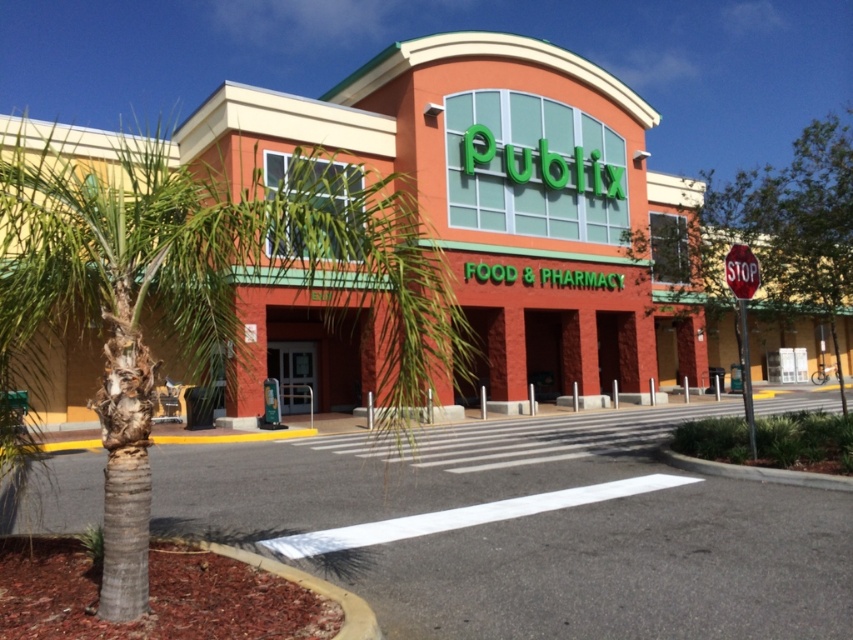
Does matte brick building at center have a lesser width compared to red glossy stop sign at upper right?

In fact, matte brick building at center might be wider than red glossy stop sign at upper right.

Locate an element on the screen. The width and height of the screenshot is (853, 640). matte brick building at center is located at coordinates (502, 193).

Which is behind, point (560, 257) or point (737, 282)?

The point (560, 257) is more distant.

Locate an element on the screen. matte brick building at center is located at coordinates (502, 193).

Is green leafy palm tree at center above red glossy stop sign at upper right?

Indeed, green leafy palm tree at center is positioned over red glossy stop sign at upper right.

Does green leafy palm tree at center come behind red glossy stop sign at upper right?

No.

What are the coordinates of `green leafy palm tree at center` in the screenshot? It's located at (119, 298).

Can you confirm if matte brick building at center is shorter than green leafy palm tree at center?

No, matte brick building at center is not shorter than green leafy palm tree at center.

Is point (454, 129) closer to viewer compared to point (84, 266)?

No.

Locate an element on the screen. matte brick building at center is located at coordinates point(502,193).